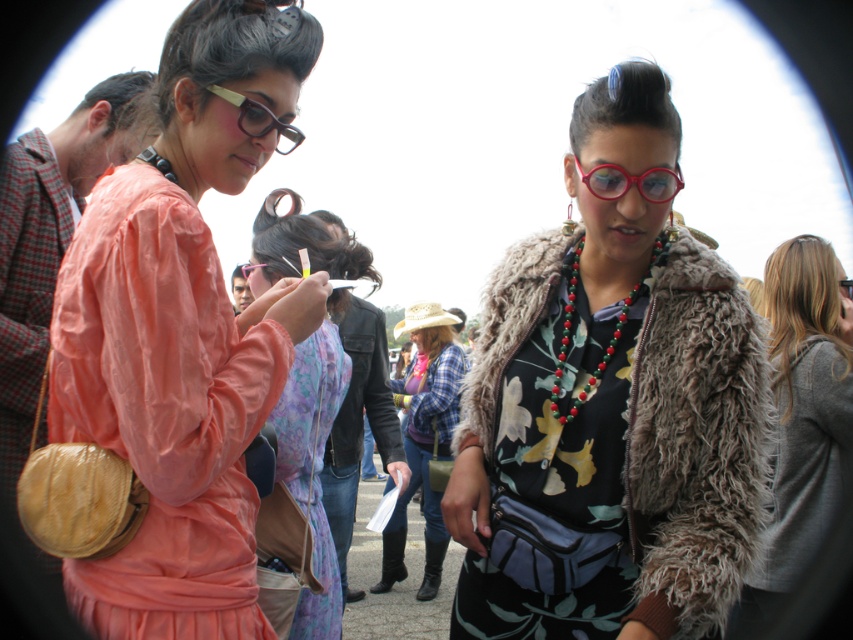
Question: Which of the following is the closest to the observer?

Choices:
 (A) (643, 342)
 (B) (416, 593)
 (C) (321, 417)

Answer: (A)

Question: Which point is closer to the camera?

Choices:
 (A) [x=415, y=376]
 (B) [x=469, y=400]
 (C) [x=228, y=92]

Answer: (C)

Question: From the image, what is the correct spatial relationship of fuzzy brown jacket at center in relation to matte pink dress at center?

Choices:
 (A) right
 (B) left

Answer: (A)

Question: Among these points, which one is nearest to the camera?

Choices:
 (A) (439, 561)
 (B) (93, 419)
 (C) (245, 264)

Answer: (B)

Question: From the image, what is the correct spatial relationship of matte pink dress at center in relation to shiny red plastic glasses at center?

Choices:
 (A) right
 (B) left

Answer: (B)

Question: Is matte yellow glasses at upper left positioned before matte black glasses at center?

Choices:
 (A) yes
 (B) no

Answer: (A)